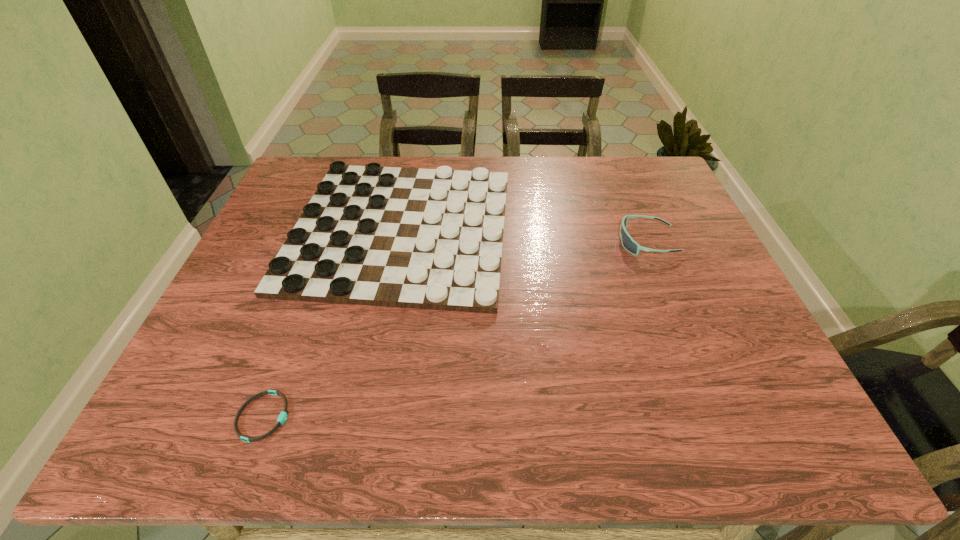
The width and height of the screenshot is (960, 540). Identify the location of object that is positioned at the far edge. (432, 239).

The height and width of the screenshot is (540, 960). I want to click on object that is at the near edge, so click(283, 416).

Find the location of a particular element. gameboard that is at the left edge is located at coordinates (432, 239).

The image size is (960, 540). What are the coordinates of `wristband that is at the left edge` in the screenshot? It's located at (283, 416).

The height and width of the screenshot is (540, 960). I want to click on object positioned at the right edge, so click(629, 244).

The image size is (960, 540). Identify the location of object that is at the far left corner. (432, 239).

Where is `object at the near left corner`? object at the near left corner is located at coordinates (283, 416).

You are a GUI agent. You are given a task and a screenshot of the screen. Output one action in this format:
    pyautogui.click(x=<x>, y=<y>)
    Task: Click on the vacant space at the far edge of the desktop
    This screenshot has width=960, height=540.
    Given the screenshot: What is the action you would take?
    pyautogui.click(x=580, y=178)

Locate an element on the screen. The width and height of the screenshot is (960, 540). free spot at the near edge of the desktop is located at coordinates (548, 441).

Locate an element on the screen. This screenshot has width=960, height=540. vacant space at the left edge is located at coordinates (195, 366).